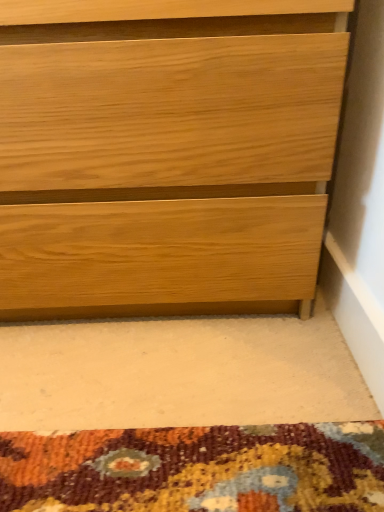
Describe the element at coordinates (166, 153) in the screenshot. I see `natural wood chest of drawers at lower right` at that location.

I want to click on natural wood chest of drawers at lower right, so click(x=166, y=153).

Identify the location of natural wood chest of drawers at lower right. This screenshot has height=512, width=384. (166, 153).